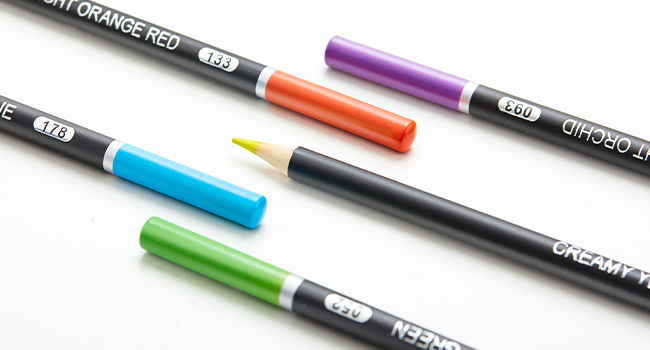
You are a GUI agent. You are given a task and a screenshot of the screen. Output one action in this format:
    pyautogui.click(x=<x>, y=<y>)
    Task: Click on the marker
    Image resolution: width=650 pixels, height=350 pixels.
    Given the screenshot: What is the action you would take?
    pyautogui.click(x=197, y=48), pyautogui.click(x=224, y=203), pyautogui.click(x=264, y=289), pyautogui.click(x=530, y=232), pyautogui.click(x=417, y=80)